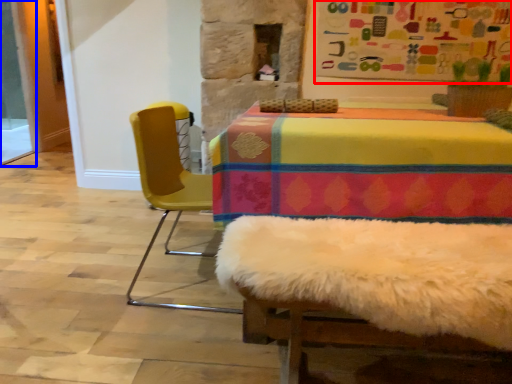
Question: Which point is closer to the camera, bulletin board (highlighted by a red box) or screen door (highlighted by a blue box)?

Choices:
 (A) bulletin board
 (B) screen door

Answer: (A)